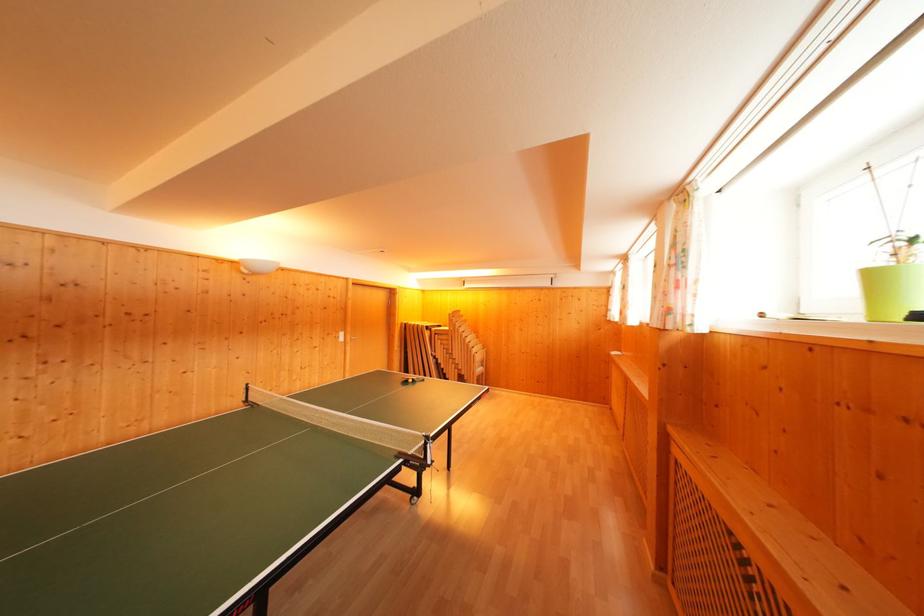
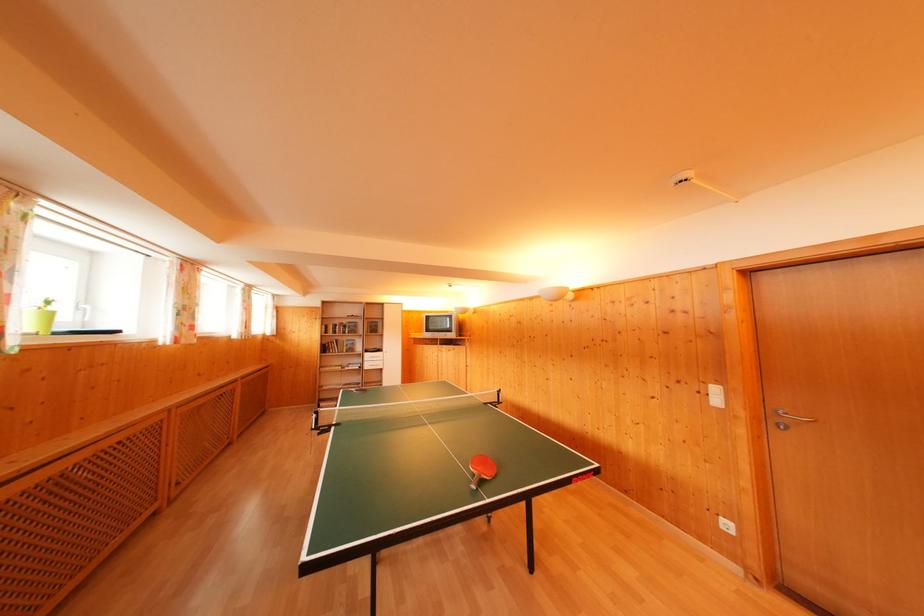
In the second image, find the point that corresponds to point 346,339 in the first image.

(721, 395)